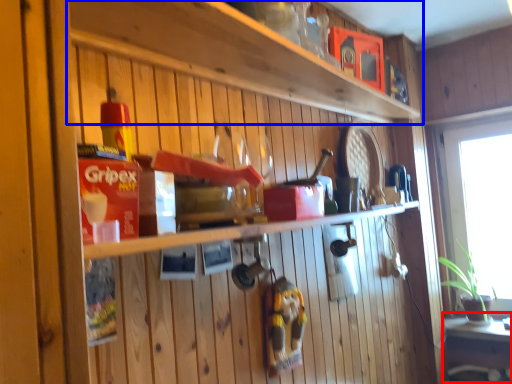
Question: Which object is further to the camera taking this photo, table (highlighted by a red box) or shelf (highlighted by a blue box)?

Choices:
 (A) table
 (B) shelf

Answer: (A)